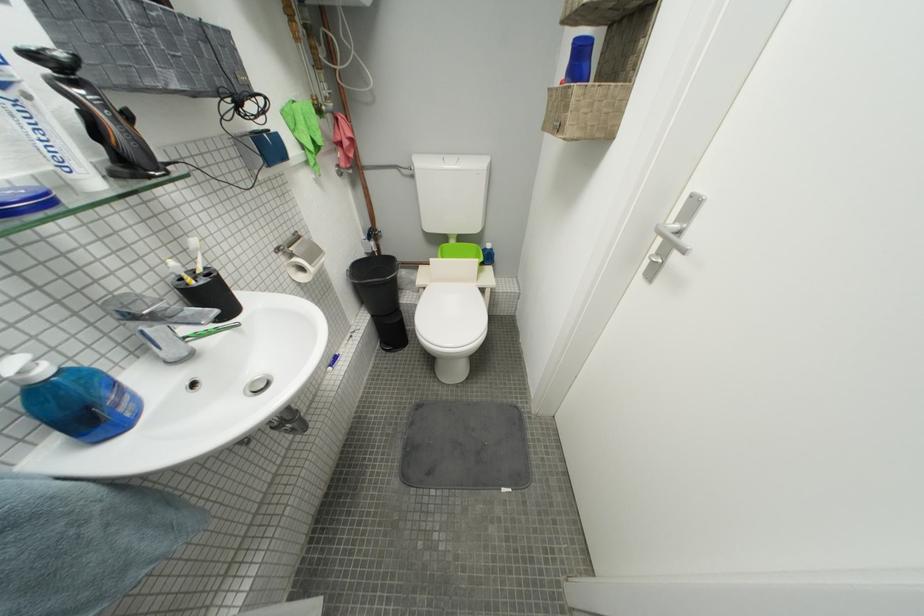
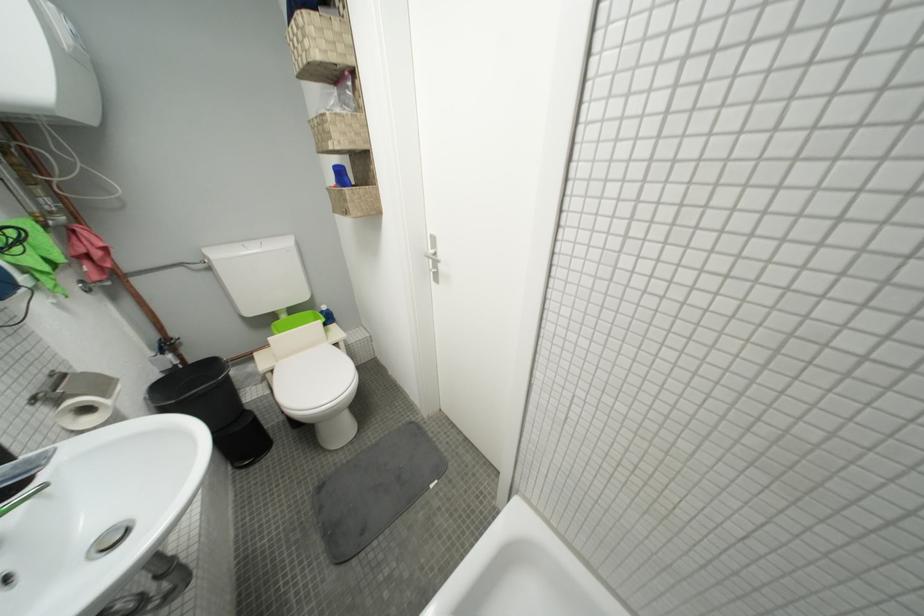
Find the pixel in the second image that matches the point at 459,166 in the first image.

(262, 252)